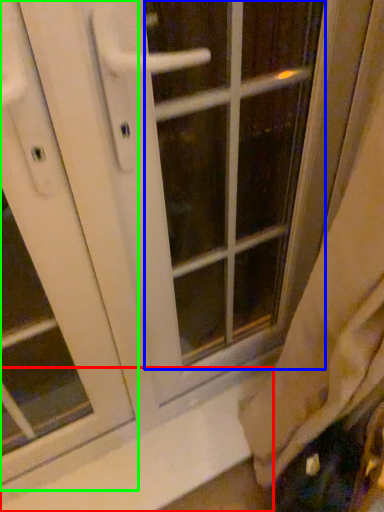
Question: Based on their relative distances, which object is nearer to window sill (highlighted by a red box)? Choose from glass door (highlighted by a blue box) and screen door (highlighted by a green box).

Choices:
 (A) glass door
 (B) screen door

Answer: (B)